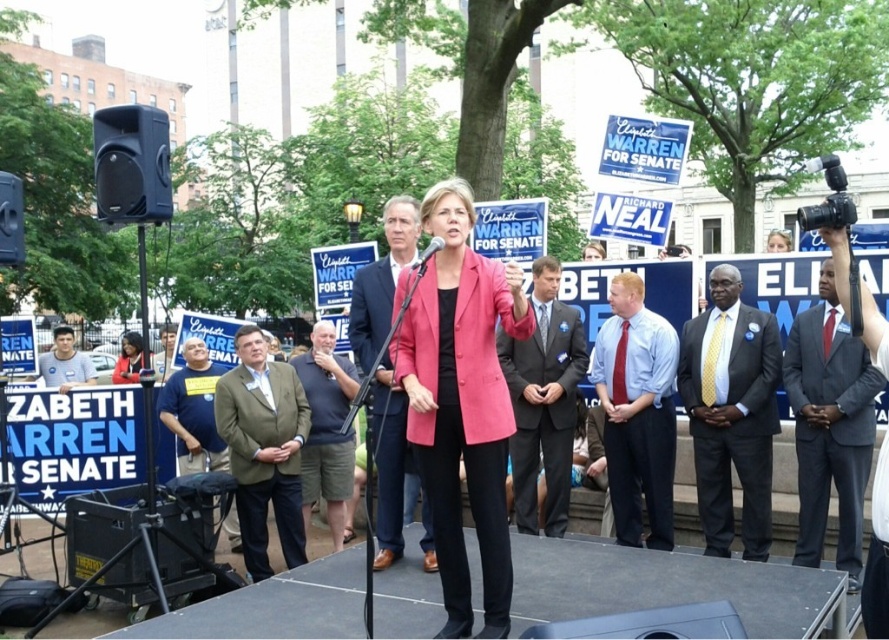
Between gray suit at center and blue t-shirt at center, which one has more height?

gray suit at center is taller.

Is point (790, 385) positioned after point (205, 468)?

No, (790, 385) is closer to viewer.

Locate an element on the screen. gray suit at center is located at coordinates (830, 426).

Find the location of a particular element. The width and height of the screenshot is (889, 640). green textured blazer at center is located at coordinates (263, 449).

Can you confirm if green textured blazer at center is positioned above light blue shirt at lower left?

Actually, green textured blazer at center is below light blue shirt at lower left.

Does point (259, 340) lie behind point (79, 352)?

No, it is in front of (79, 352).

This screenshot has height=640, width=889. Identify the location of green textured blazer at center. (263, 449).

Is the position of matte blue suit at center less distant than that of light blue shirt at lower left?

Yes, matte blue suit at center is closer to the viewer.

From the picture: Which is more to the right, matte blue suit at center or light blue shirt at lower left?

matte blue suit at center is more to the right.

Which is in front, point (381, 406) or point (61, 344)?

Point (381, 406)

Where is `matte blue suit at center`? This screenshot has width=889, height=640. matte blue suit at center is located at coordinates (381, 282).